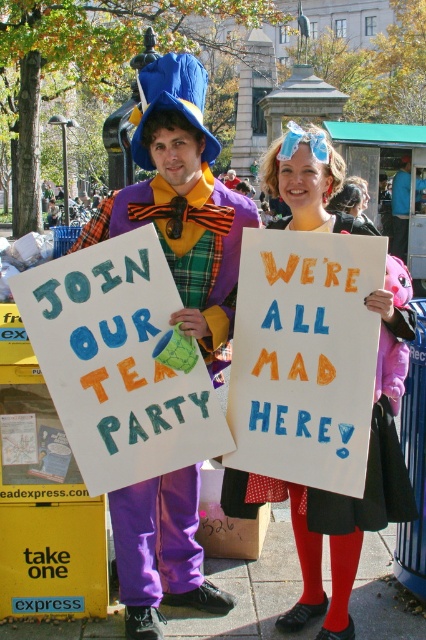
Question: Which of these objects is positioned farthest from the polka dot fabric dress at center?

Choices:
 (A) handwritten paper sign at center
 (B) matte purple pants at center
 (C) purple plaid vest at center

Answer: (B)

Question: Is the position of matte purple pants at center less distant than that of purple plaid vest at center?

Choices:
 (A) no
 (B) yes

Answer: (B)

Question: Which object is farther from the camera taking this photo?

Choices:
 (A) handwritten paper sign at center
 (B) purple plaid vest at center

Answer: (B)

Question: Does matte purple pants at center have a larger size compared to handwritten paper sign at center?

Choices:
 (A) no
 (B) yes

Answer: (B)

Question: Is handwritten paper sign at center above purple plaid vest at center?

Choices:
 (A) no
 (B) yes

Answer: (A)

Question: Which of the following is the farthest from the observer?

Choices:
 (A) (97, 451)
 (B) (333, 516)

Answer: (A)